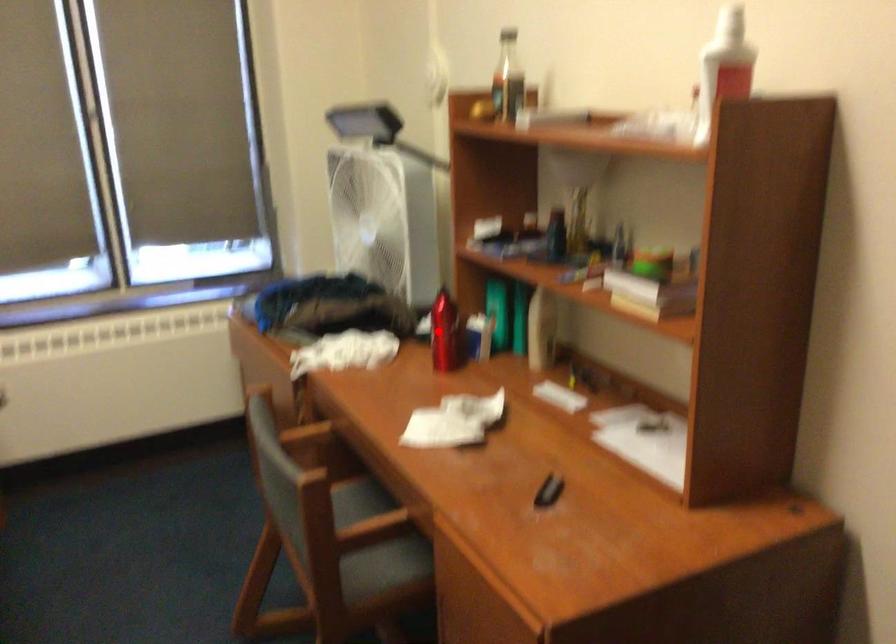
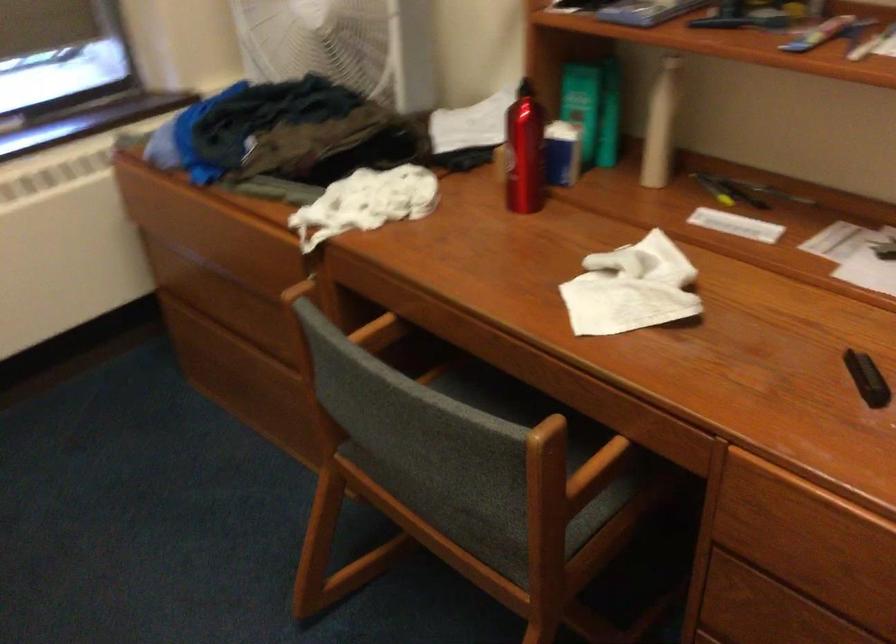
Question: I am providing you with two images of the same scene from different viewpoints. A red point is shown in image1. For the corresponding object point in image2, is it positioned nearer or farther from the camera?

Choices:
 (A) Nearer
 (B) Farther

Answer: (A)